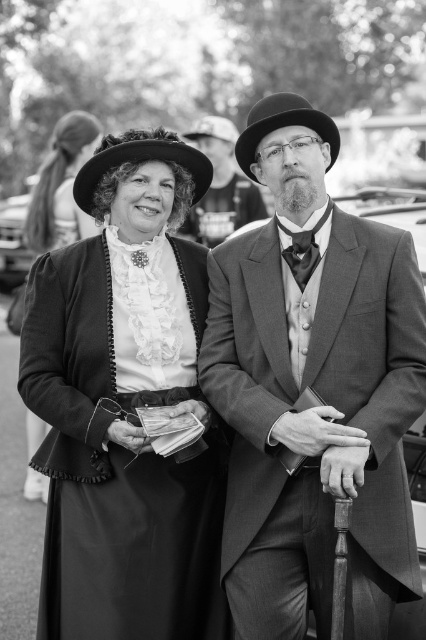
Question: Observing the image, what is the correct spatial positioning of ruffled satin dress at center in reference to smooth leather hat at center?

Choices:
 (A) below
 (B) above

Answer: (A)

Question: Considering the relative positions of smooth leather hat at center and smooth felt hat at center in the image provided, where is smooth leather hat at center located with respect to smooth felt hat at center?

Choices:
 (A) below
 (B) above

Answer: (A)

Question: Among these points, which one is farthest from the camera?

Choices:
 (A) 104,477
 (B) 189,131

Answer: (B)

Question: Does ruffled satin dress at center appear over smooth felt hat at center?

Choices:
 (A) yes
 (B) no

Answer: (B)

Question: Which point is closer to the camera?

Choices:
 (A) (100, 154)
 (B) (278, 120)
 (C) (192, 136)

Answer: (B)

Question: Which of the following is the closest to the observer?

Choices:
 (A) shiny black bowler hat at center
 (B) felt hat at upper left
 (C) smooth fabric suit at center

Answer: (C)